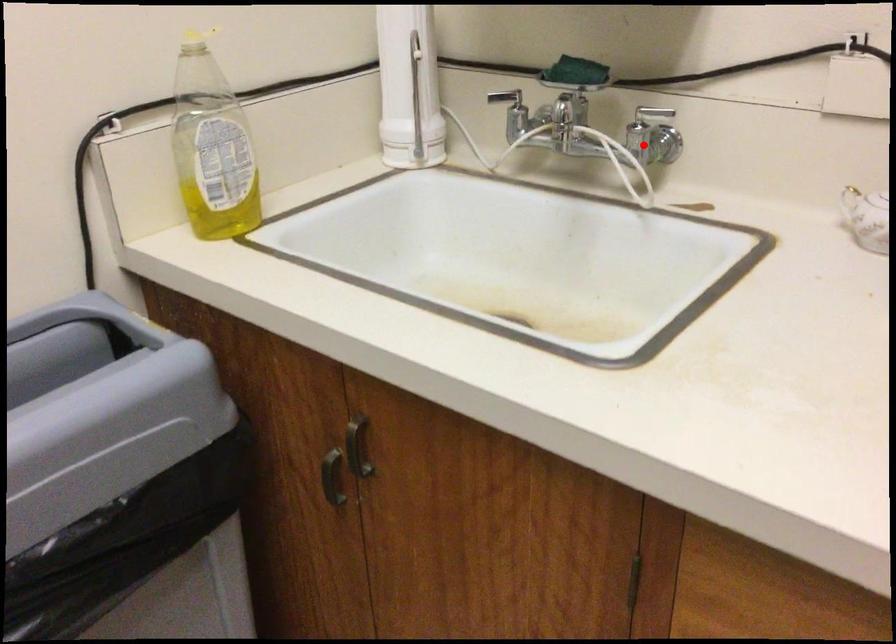
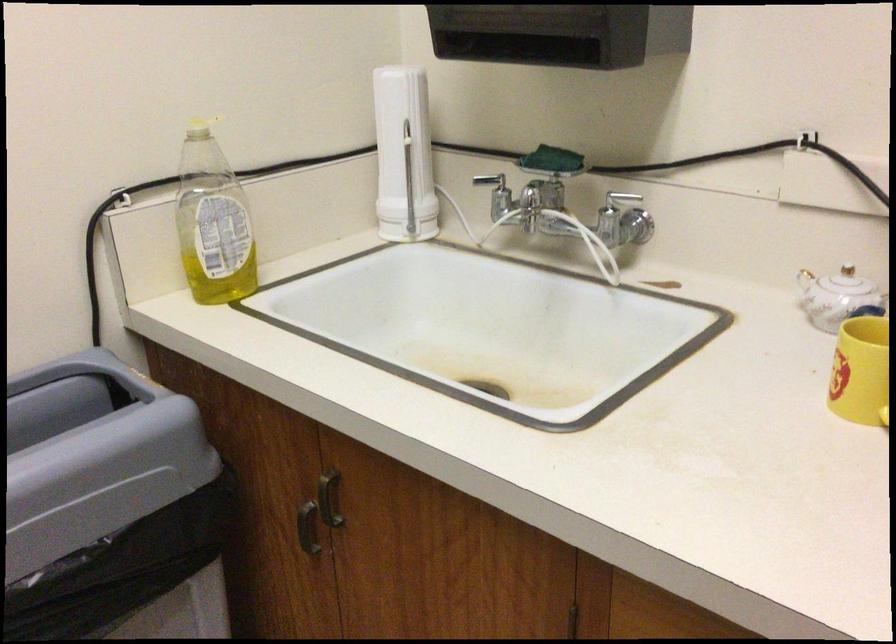
Where in the second image is the point corresponding to the highlighted location from the first image?

(615, 225)